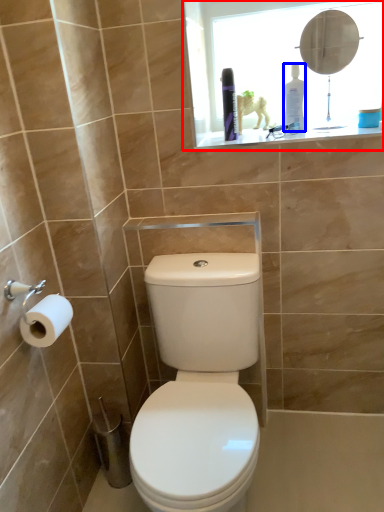
Question: Which object is further to the camera taking this photo, medicine cabinet (highlighted by a red box) or toiletry (highlighted by a blue box)?

Choices:
 (A) medicine cabinet
 (B) toiletry

Answer: (B)